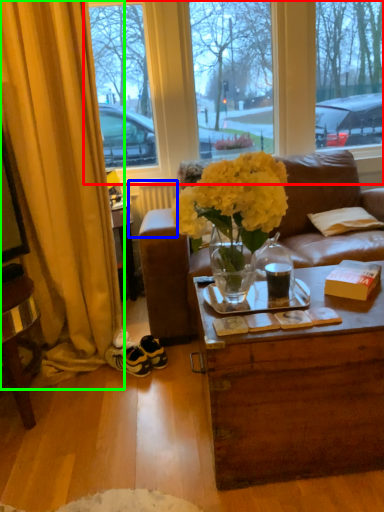
Question: Which object is the farthest from window (highlighted by a red box)? Choose among these: radiator (highlighted by a blue box) or curtain (highlighted by a green box).

Choices:
 (A) radiator
 (B) curtain

Answer: (B)